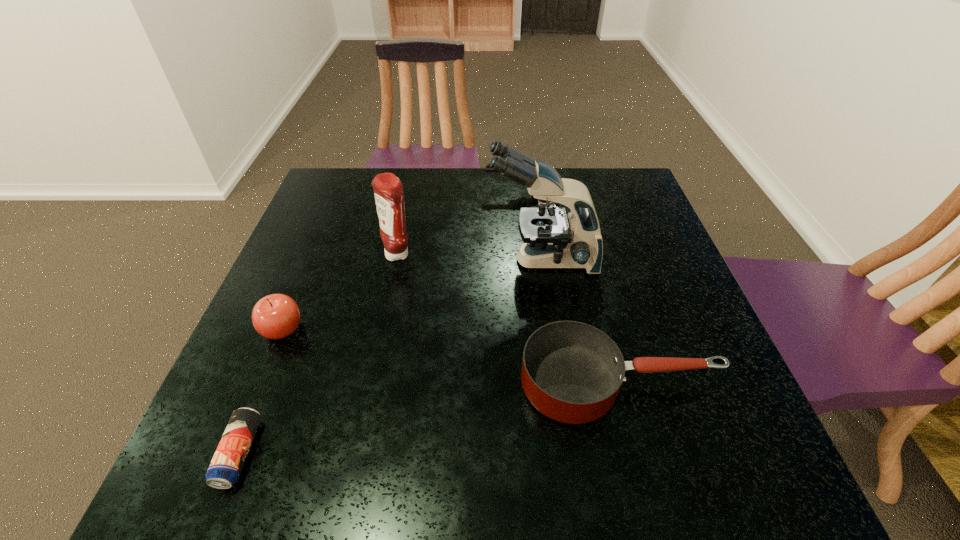
Find the location of `vacant region between the microscope and the second shortest object`. vacant region between the microscope and the second shortest object is located at coordinates (580, 321).

I want to click on vacant area that lies between the tallest object and the apple, so click(x=413, y=295).

At what (x,y) coordinates should I click in order to perform the action: click on free space between the tallest object and the condiment. Please return your answer as a coordinate pair (x, y). Looking at the image, I should click on (470, 257).

Locate an element on the screen. The width and height of the screenshot is (960, 540). vacant space that's between the condiment and the apple is located at coordinates (341, 292).

You are a GUI agent. You are given a task and a screenshot of the screen. Output one action in this format:
    pyautogui.click(x=<x>, y=<y>)
    Task: Click on the unoccupied area between the condiment and the tallest object
    This screenshot has height=540, width=960.
    Given the screenshot: What is the action you would take?
    pyautogui.click(x=470, y=257)

You are a GUI agent. You are given a task and a screenshot of the screen. Output one action in this format:
    pyautogui.click(x=<x>, y=<y>)
    Task: Click on the vacant point located between the beer can and the apple
    The width and height of the screenshot is (960, 540).
    Given the screenshot: What is the action you would take?
    pyautogui.click(x=261, y=392)

You are a GUI agent. You are given a task and a screenshot of the screen. Output one action in this format:
    pyautogui.click(x=<x>, y=<y>)
    Task: Click on the fourth closest object relative to the pan
    
    Given the screenshot: What is the action you would take?
    pyautogui.click(x=224, y=470)

Image resolution: width=960 pixels, height=540 pixels. What are the coordinates of `object that stands as the fifth closest to the microscope` in the screenshot? It's located at (224, 470).